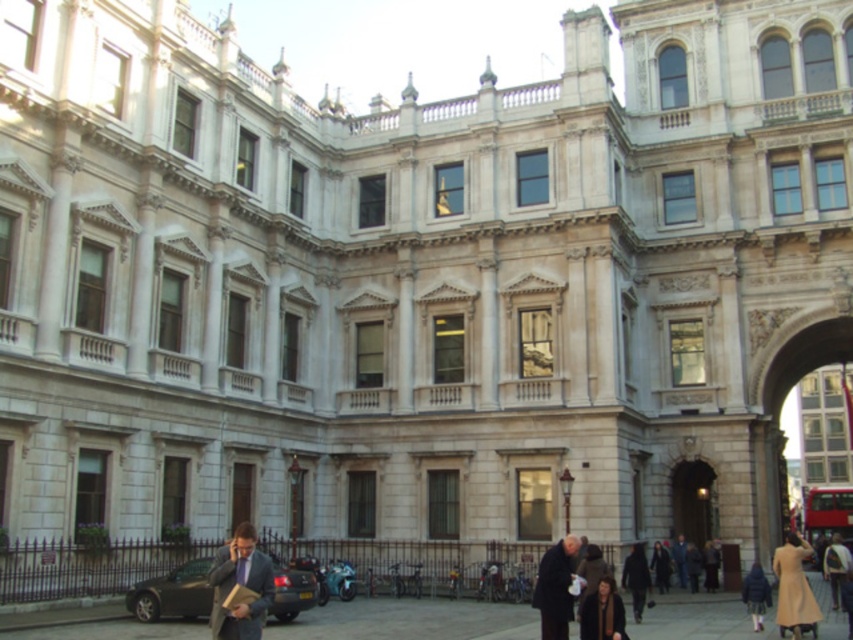
Does matte black suit at lower left appear on the right side of dark fabric coat at lower right?

In fact, matte black suit at lower left is to the left of dark fabric coat at lower right.

Does matte black suit at lower left have a larger size compared to dark fabric coat at lower right?

Indeed, matte black suit at lower left has a larger size compared to dark fabric coat at lower right.

Does point (250, 579) come closer to viewer compared to point (642, 572)?

That is True.

This screenshot has height=640, width=853. I want to click on matte black suit at lower left, so (x=241, y=586).

Does smooth concrete pavement at lower center appear over dark blue wool coat at lower right?

Actually, smooth concrete pavement at lower center is below dark blue wool coat at lower right.

Which is behind, point (512, 609) or point (761, 614)?

The point (512, 609) is behind.

Which is in front, point (498, 618) or point (759, 618)?

Point (759, 618) is more forward.

This screenshot has height=640, width=853. I want to click on smooth concrete pavement at lower center, so click(409, 620).

Does smooth concrete pavement at lower center have a lesser height compared to dark brown leather coat at lower center?

Indeed, smooth concrete pavement at lower center has a lesser height compared to dark brown leather coat at lower center.

Can you confirm if smooth concrete pavement at lower center is positioned to the left of dark brown leather coat at lower center?

Correct, you'll find smooth concrete pavement at lower center to the left of dark brown leather coat at lower center.

Does point (276, 628) lie in front of point (572, 612)?

No, it is not.

Where is `smooth concrete pavement at lower center`? smooth concrete pavement at lower center is located at coordinates tap(409, 620).